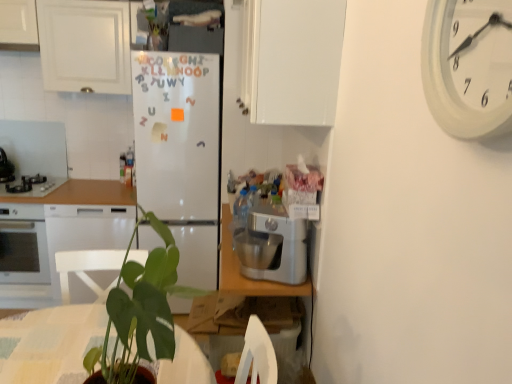
Image resolution: width=512 pixels, height=384 pixels. In order to click on free spot above silver metallic stand mixer at center (from a real-world perspective) in this screenshot , I will do coord(270,210).